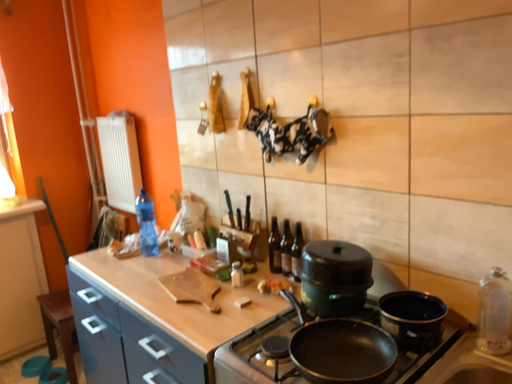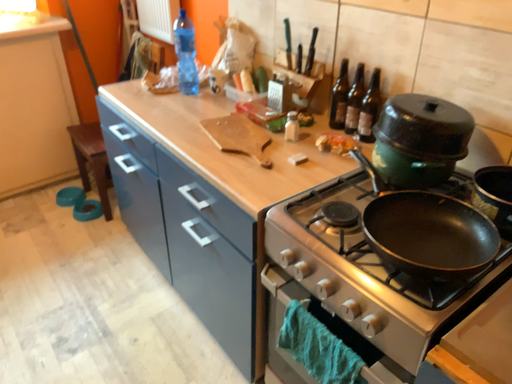
Question: How did the camera likely rotate when shooting the video?

Choices:
 (A) rotated downward
 (B) rotated upward

Answer: (A)